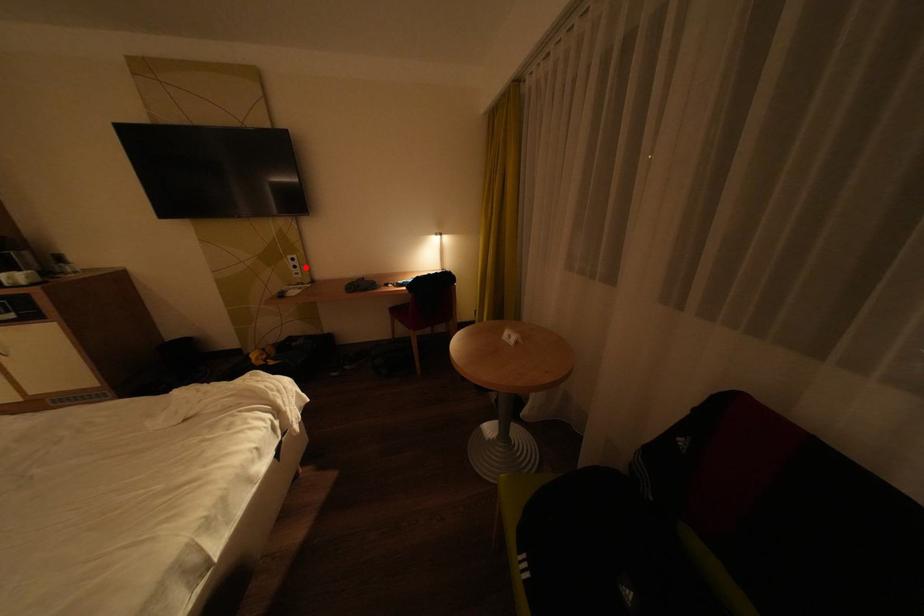
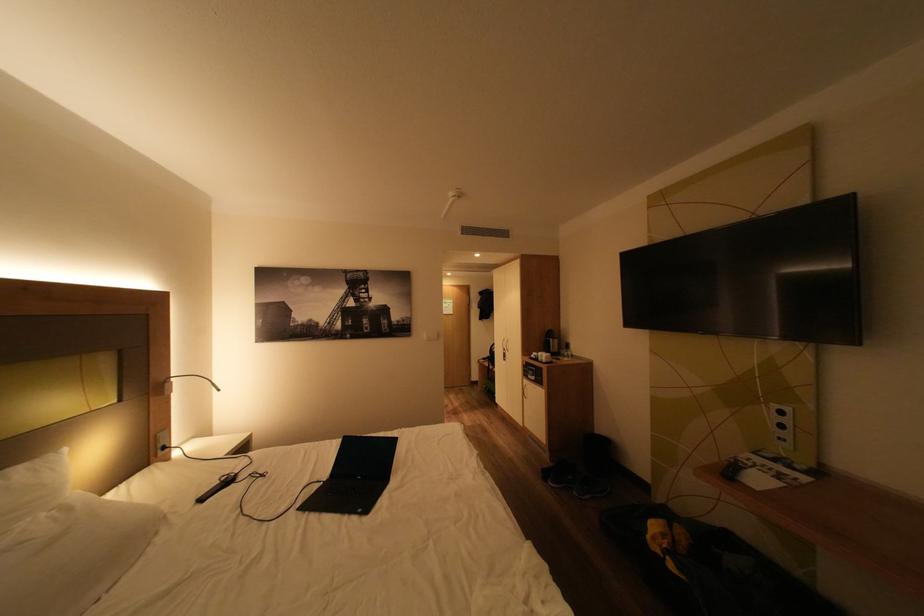
Question: I am providing you with two images of the same scene from different viewpoints. In image1, a red point is highlighted. Considering the same 3D point in image2, which of the following is correct?

Choices:
 (A) It is closer
 (B) It is farther

Answer: (B)